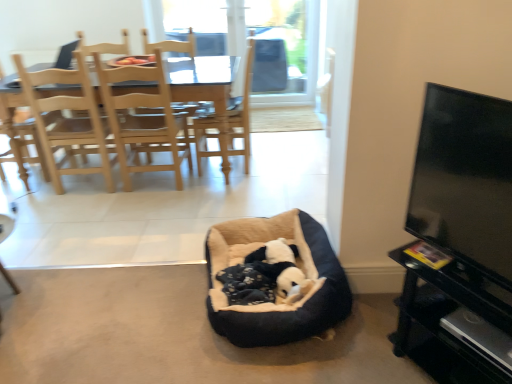
The height and width of the screenshot is (384, 512). In order to click on flat screen tv at right in this screenshot , I will do `click(465, 179)`.

This screenshot has height=384, width=512. What are the coordinates of `light wood dining chair at upper left` in the screenshot? It's located at (170, 44).

This screenshot has height=384, width=512. What are the coordinates of `flat screen tv at right` in the screenshot? It's located at (465, 179).

Could you measure the distance between light brown wood chair at left, the 2th chair positioned from the left, and light wood chair at upper left, arranged as the 2th chair when viewed from the right?

light brown wood chair at left, the 2th chair positioned from the left, is 31.46 inches away from light wood chair at upper left, arranged as the 2th chair when viewed from the right.

What's the angular difference between light brown wood chair at left, the 2th chair positioned from the left, and light wood chair at upper left, the 1th chair positioned from the left,'s facing directions?

The angular difference between light brown wood chair at left, the 2th chair positioned from the left, and light wood chair at upper left, the 1th chair positioned from the left, is 179 degrees.

Considering the positions of objects light brown wood chair at left, the first chair in the right-to-left sequence, and light wood chair at upper left, the 1th chair positioned from the left, in the image provided, who is more to the left, light brown wood chair at left, the first chair in the right-to-left sequence, or light wood chair at upper left, the 1th chair positioned from the left,?

light wood chair at upper left, the 1th chair positioned from the left.

Is light brown wood chair at left, the 2th chair positioned from the left, oriented towards light wood chair at upper left, the 1th chair positioned from the left?

Yes, light brown wood chair at left, the 2th chair positioned from the left, is turned towards light wood chair at upper left, the 1th chair positioned from the left.

From a real-world perspective, which is physically above, flat screen tv at right or light wood chair at upper left, the 1th chair positioned from the left?

flat screen tv at right, from a real-world perspective.

Does flat screen tv at right have a smaller size compared to light wood chair at upper left, arranged as the 2th chair when viewed from the right?

Yes.

This screenshot has width=512, height=384. Find the location of `television above the light wood chair at upper left, the 1th chair positioned from the left (from a real-world perspective)`. television above the light wood chair at upper left, the 1th chair positioned from the left (from a real-world perspective) is located at coordinates (465, 179).

In the scene shown: From the image's perspective, would you say flat screen tv at right is shown under light wood chair at upper left, arranged as the 2th chair when viewed from the right?

Yes, from the image's perspective, flat screen tv at right is below light wood chair at upper left, arranged as the 2th chair when viewed from the right.

Does light wood chair at upper left, arranged as the 2th chair when viewed from the right, turn towards black glossy tv stand at lower right?

No, light wood chair at upper left, arranged as the 2th chair when viewed from the right, is not aimed at black glossy tv stand at lower right.

Who is shorter, light wood chair at upper left, the 1th chair positioned from the left, or black glossy tv stand at lower right?

black glossy tv stand at lower right.

What are the coordinates of `the 1st chair behind the black glossy tv stand at lower right, counting from the anchor's position` in the screenshot? It's located at (67, 121).

Based on the photo, between light wood chair at upper left, the 1th chair positioned from the left, and black glossy tv stand at lower right, which one is positioned in front?

black glossy tv stand at lower right is closer to the camera.

Which of these two, black plush dog bed at center or soft fleece dog bed at center, is wider?

With larger width is soft fleece dog bed at center.

From a real-world perspective, who is located lower, black plush dog bed at center or soft fleece dog bed at center?

In real-world perspective, black plush dog bed at center is lower.

This screenshot has width=512, height=384. I want to click on dog bed on the left of the black plush dog bed at center, so click(x=271, y=304).

From the picture: How different are the orientations of black glossy tv stand at lower right and flat screen tv at right in degrees?

There is a 0.000364-degree angle between the facing directions of black glossy tv stand at lower right and flat screen tv at right.

Is black glossy tv stand at lower right aimed at flat screen tv at right?

No, black glossy tv stand at lower right is not aimed at flat screen tv at right.

Is black glossy tv stand at lower right in front of or behind flat screen tv at right in the image?

Clearly, black glossy tv stand at lower right is behind flat screen tv at right.

Does point (419, 252) appear closer or farther from the camera than point (416, 228)?

Point (419, 252) is positioned closer to the camera compared to point (416, 228).

Between point (482, 182) and point (192, 90), which one is positioned behind?

The point (192, 90) is more distant.

Is flat screen tv at right next to light brown wood chair at left, the 2th chair positioned from the left, and touching it?

They are not placed beside each other.

How different are the orientations of flat screen tv at right and light brown wood chair at left, the 2th chair positioned from the left, in degrees?

The facing directions of flat screen tv at right and light brown wood chair at left, the 2th chair positioned from the left, are 59.3 degrees apart.

Is the position of flat screen tv at right less distant than that of light brown wood chair at left, the first chair in the right-to-left sequence?

Yes, it is.

Is black glossy tv stand at lower right oriented away from light brown wood chair at left, the first chair in the right-to-left sequence?

black glossy tv stand at lower right is not turned away from light brown wood chair at left, the first chair in the right-to-left sequence.

Considering the positions of objects black glossy tv stand at lower right and light brown wood chair at left, the first chair in the right-to-left sequence, in the image provided, who is more to the left, black glossy tv stand at lower right or light brown wood chair at left, the first chair in the right-to-left sequence,?

From the viewer's perspective, light brown wood chair at left, the first chair in the right-to-left sequence, appears more on the left side.

Based on the photo, can you confirm if black glossy tv stand at lower right is taller than light brown wood chair at left, the first chair in the right-to-left sequence?

In fact, black glossy tv stand at lower right may be shorter than light brown wood chair at left, the first chair in the right-to-left sequence.

From a real-world perspective, who is located lower, black glossy tv stand at lower right or light brown wood chair at left, the first chair in the right-to-left sequence?

black glossy tv stand at lower right, from a real-world perspective.

Where is `chair on the left of light brown wood chair at left, the first chair in the right-to-left sequence`? chair on the left of light brown wood chair at left, the first chair in the right-to-left sequence is located at coordinates (67, 121).

From the image's perspective, starting from the flat screen tv at right, which chair is the 1st one above? Please provide its 2D coordinates.

[(67, 121)]

Which object lies further to the anchor point light wood dining chair at upper left, black glossy tv stand at lower right or light wood chair at upper left, the 1th chair positioned from the left?

black glossy tv stand at lower right.

Estimate the real-world distances between objects in this image. Which object is closer to soft fleece dog bed at center, black plush dog bed at center or black glossy tv stand at lower right?

Among the two, black plush dog bed at center is located nearer to soft fleece dog bed at center.

From the image, which object appears to be nearer to light wood chair at upper left, arranged as the 2th chair when viewed from the right, light wood dining chair at upper left or flat screen tv at right?

light wood dining chair at upper left.

Looking at the image, which one is located further to flat screen tv at right, light brown wood chair at left, the 2th chair positioned from the left, or black plush dog bed at center?

Among the two, light brown wood chair at left, the 2th chair positioned from the left, is located further to flat screen tv at right.

From the image, which object appears to be nearer to black glossy tv stand at lower right, black plush dog bed at center or flat screen tv at right?

The object closer to black glossy tv stand at lower right is flat screen tv at right.

Estimate the real-world distances between objects in this image. Which object is closer to light wood chair at upper left, the 1th chair positioned from the left, black plush dog bed at center or black glossy tv stand at lower right?

black plush dog bed at center lies closer to light wood chair at upper left, the 1th chair positioned from the left, than the other object.

From the image, which object appears to be nearer to black glossy tv stand at lower right, light brown wood chair at left, the 2th chair positioned from the left, or flat screen tv at right?

Based on the image, flat screen tv at right appears to be nearer to black glossy tv stand at lower right.

From the picture: Looking at the image, which one is located further to black glossy tv stand at lower right, light wood chair at upper left, arranged as the 2th chair when viewed from the right, or light brown wood chair at left, the 2th chair positioned from the left?

The object further to black glossy tv stand at lower right is light wood chair at upper left, arranged as the 2th chair when viewed from the right.

Image resolution: width=512 pixels, height=384 pixels. Find the location of `armchair between light wood chair at upper left, the 1th chair positioned from the left, and black plush dog bed at center, in the horizontal direction`. armchair between light wood chair at upper left, the 1th chair positioned from the left, and black plush dog bed at center, in the horizontal direction is located at coordinates (170, 44).

What are the coordinates of `chair between light wood chair at upper left, the 1th chair positioned from the left, and soft fleece dog bed at center` in the screenshot? It's located at point(206,92).

Locate an element on the screen. The image size is (512, 384). animal located between soft fleece dog bed at center and light wood dining chair at upper left in the depth direction is located at coordinates (281, 270).

This screenshot has width=512, height=384. I want to click on chair between light wood chair at upper left, arranged as the 2th chair when viewed from the right, and flat screen tv at right from left to right, so click(x=206, y=92).